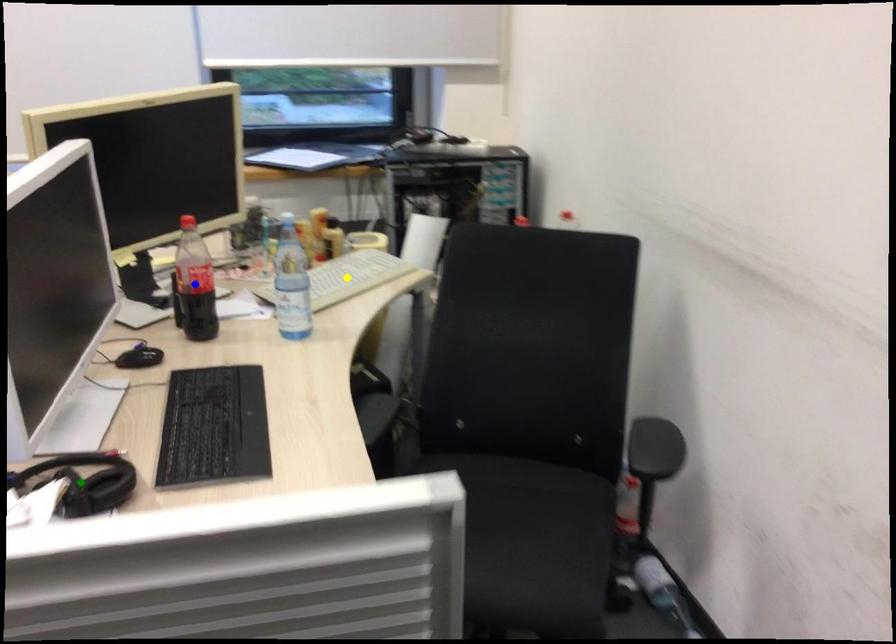
Order these from nearest to farthest:
blue point, yellow point, green point

green point → blue point → yellow point